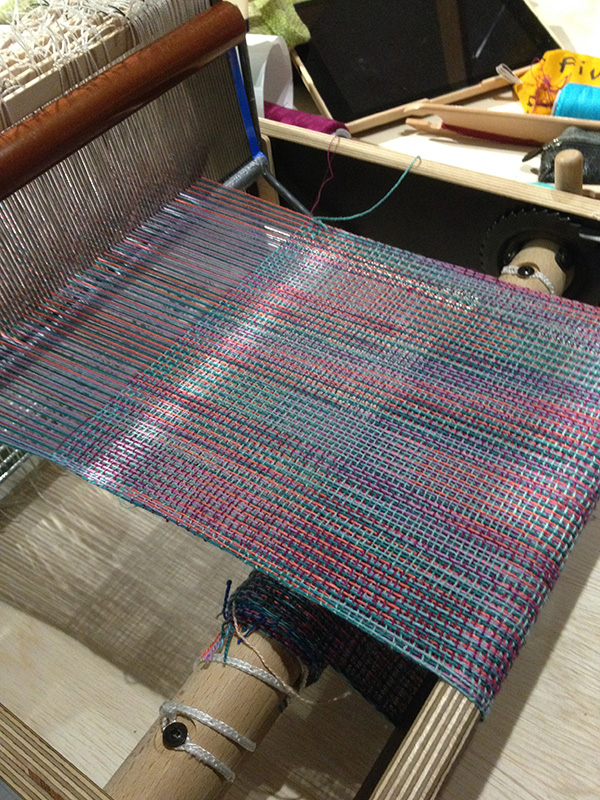
At what (x,y) coordinates should I click in order to perform the action: click on window. Please return your answer as a coordinate pair (x, y). Image resolution: width=600 pixels, height=800 pixels. Looking at the image, I should click on (17, 6).